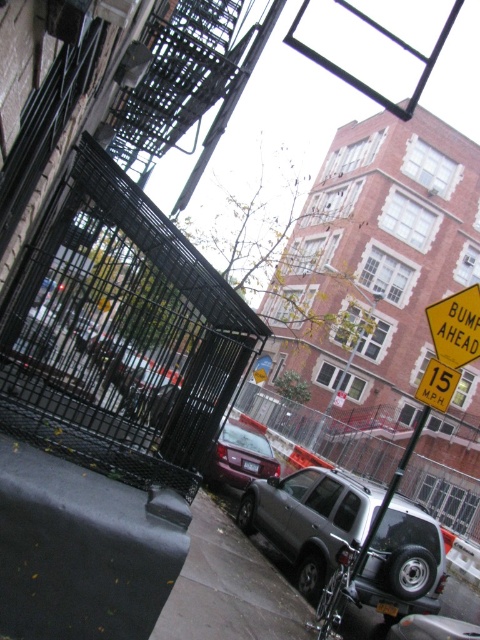
You are a delivery person who needs to park your delivery van next to the matte purple car at center and the yellow plastic speed limit sign at upper right. Since the van is 2 meters tall, can you park it there without hitting the sign?

The matte purple car at center is much taller than the yellow plastic speed limit sign at upper right. Since the van is 2 meters tall, if the speed limit sign is shorter than 2 meters, the van might hit it. However, since the car is taller than the sign, it implies the sign is shorter than the car. If the car is taller than the sign but the van is only 2 meters, we need to know the car height. But since the description only states the car is taller than the sign, we can infer the sign is shorter than the 2m

You are a delivery driver who needs to park your matte purple car at center in a parking spot that can only accommodate vehicles narrower than the yellow plastic speed limit sign at upper right. Can your car fit in the spot?

The matte purple car at center is wider than the yellow plastic speed limit sign at upper right, so it cannot fit in the parking spot designed for narrower vehicles.